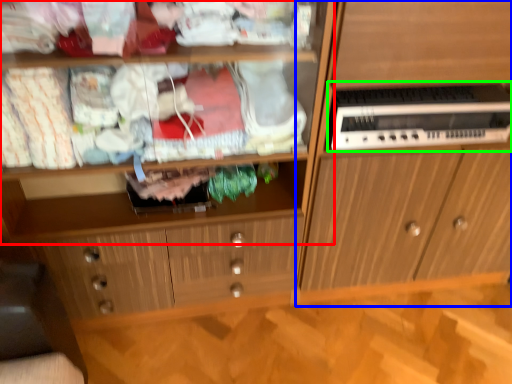
Question: Which object is positioned farthest from shelf (highlighted by a red box)? Select from cabinetry (highlighted by a blue box) and home appliance (highlighted by a green box).

Choices:
 (A) cabinetry
 (B) home appliance

Answer: (B)